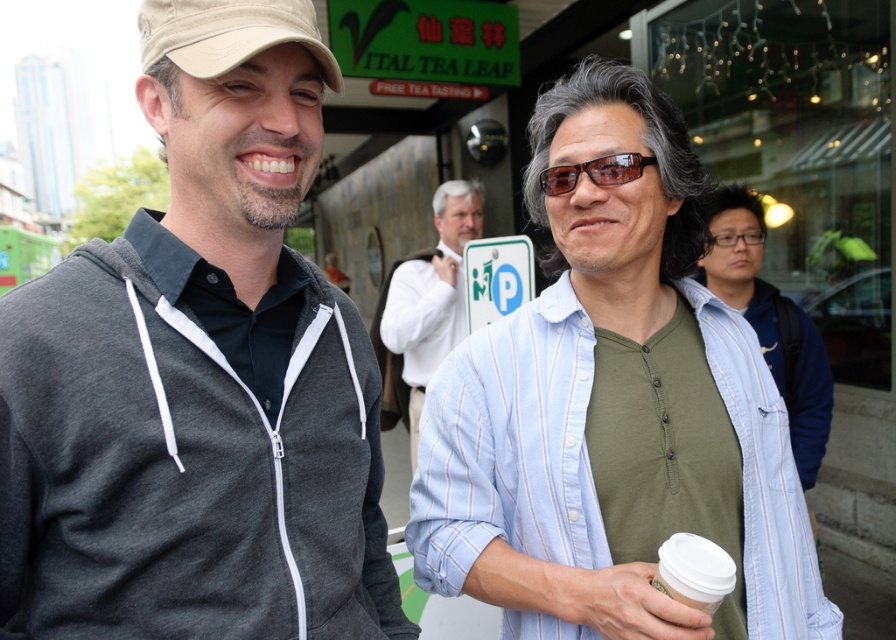
Between dark gray zip-up hoodie at left and sunglasses at center, which one is positioned lower?

dark gray zip-up hoodie at left

Which is behind, point (248, 8) or point (607, 168)?

Point (607, 168)

At what (x,y) coordinates should I click in order to perform the action: click on dark gray zip-up hoodie at left. Please return your answer as a coordinate pair (x, y). This screenshot has width=896, height=640. Looking at the image, I should click on (199, 376).

Between light blue striped shirt at center and white paper cup at center, which one is positioned lower?

white paper cup at center

Does light blue striped shirt at center appear on the left side of white paper cup at center?

Yes, light blue striped shirt at center is to the left of white paper cup at center.

You are a GUI agent. You are given a task and a screenshot of the screen. Output one action in this format:
    pyautogui.click(x=<x>, y=<y>)
    Task: Click on the light blue striped shirt at center
    The image size is (896, 640).
    Given the screenshot: What is the action you would take?
    pyautogui.click(x=613, y=410)

Does white shirt at center appear on the right side of white paper cup at center?

No, white shirt at center is not to the right of white paper cup at center.

Does white shirt at center lie in front of white paper cup at center?

No, white shirt at center is behind white paper cup at center.

Is point (426, 262) closer to camera compared to point (712, 552)?

No, (426, 262) is behind (712, 552).

I want to click on white shirt at center, so click(x=431, y=296).